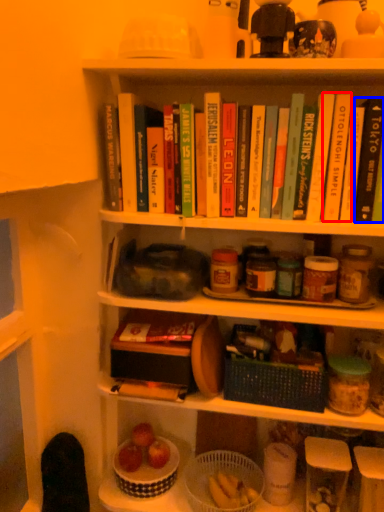
Question: Which point is closer to the camera, paperback book (highlighted by a red box) or paperback book (highlighted by a blue box)?

Choices:
 (A) paperback book
 (B) paperback book

Answer: (B)